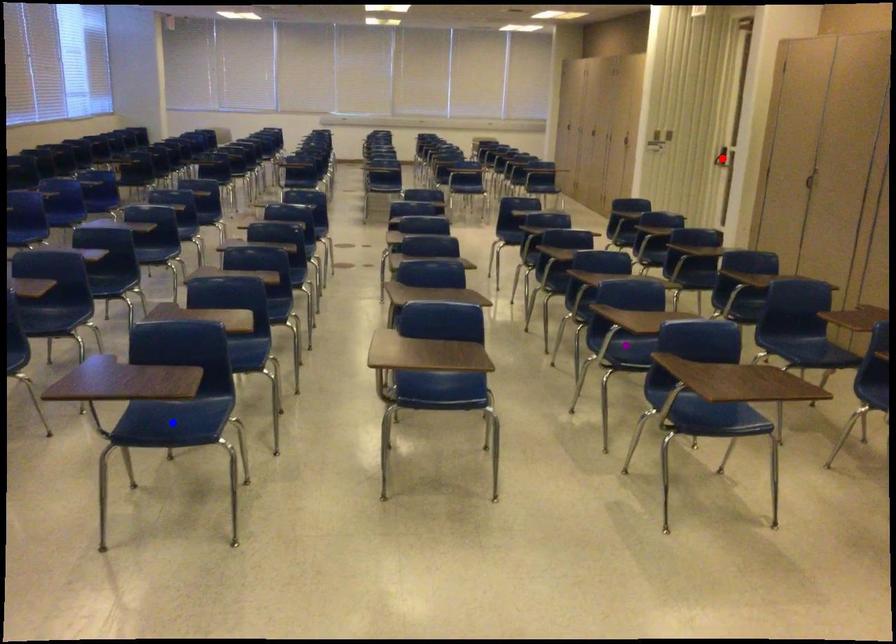
Order these from nearest to farthest:
1. red point
2. blue point
3. purple point

blue point, purple point, red point